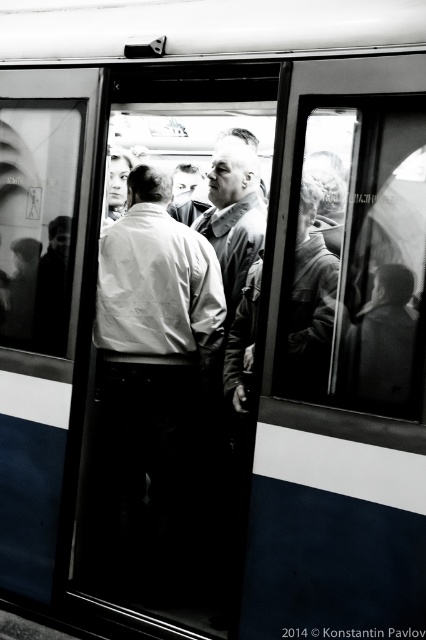
Which is in front, point (160, 362) or point (230, 156)?

Point (160, 362)

In the scene shown: Does white shirt at center appear on the left side of matte gray jacket at center?

Indeed, white shirt at center is positioned on the left side of matte gray jacket at center.

Find the location of a particular element. white shirt at center is located at coordinates (152, 380).